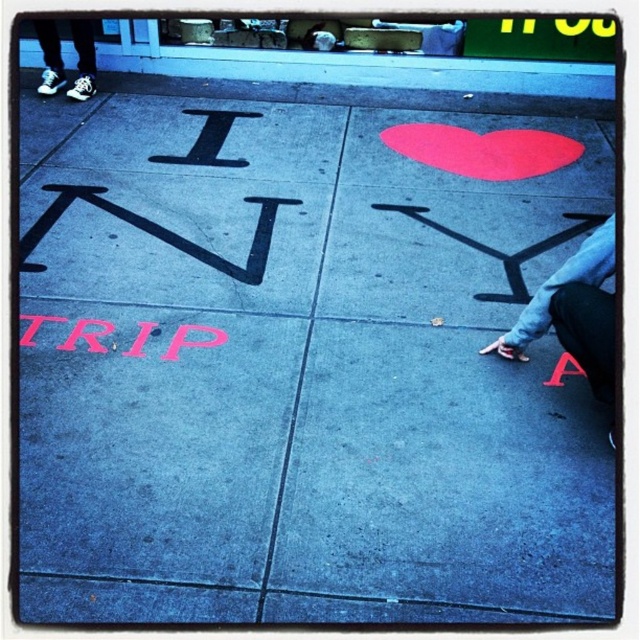
You are a delivery person trying to place a box on the blue concrete curb at upper left and the pink matte trip at lower left. Which surface will require you to lift the box higher to place it?

The blue concrete curb at upper left requires lifting the box higher because it has a greater height compared to the pink matte trip at lower left.

You are a delivery person trying to avoid stepping on the painted message. You see the blue concrete curb at upper left and the pink matte trip at lower left. Which object is closer to you as you stand facing the sidewalk?

The blue concrete curb at upper left is closer to you because the pink matte trip at lower left is behind it.

You are standing on the sidewalk and see the pink matte trip at lower left and white canvas sneakers at upper left. Which object is positioned to the right of the other?

The pink matte trip at lower left is to the right of the white canvas sneakers at upper left.